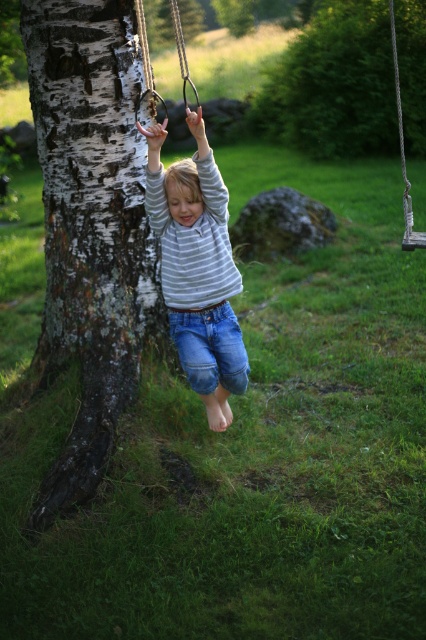
Where is `green leafy tree at upper center`? This screenshot has height=640, width=426. green leafy tree at upper center is located at coordinates (333, 84).

Who is positioned more to the left, green leafy tree at upper center or striped cotton shirt at center?

From the viewer's perspective, striped cotton shirt at center appears more on the left side.

Image resolution: width=426 pixels, height=640 pixels. What do you see at coordinates (333, 84) in the screenshot?
I see `green leafy tree at upper center` at bounding box center [333, 84].

Locate an element on the screen. The image size is (426, 640). green leafy tree at upper center is located at coordinates (333, 84).

Does white bark tree trunk at left have a smaller size compared to striped cotton shirt at center?

No, white bark tree trunk at left is not smaller than striped cotton shirt at center.

Does white bark tree trunk at left have a greater height compared to striped cotton shirt at center?

Yes.

Who is more distant from viewer, (58, 90) or (219, 369)?

The point (58, 90) is more distant.

This screenshot has width=426, height=640. In order to click on white bark tree trunk at left in this screenshot , I will do `click(89, 224)`.

Which of these two, white bark tree trunk at left or green leafy tree at upper center, stands taller?

green leafy tree at upper center is taller.

Is white bark tree trunk at left positioned behind green leafy tree at upper center?

No, it is in front of green leafy tree at upper center.

Which is behind, point (126, 289) or point (316, 150)?

The point (316, 150) is behind.

Where is `white bark tree trunk at left`? This screenshot has width=426, height=640. white bark tree trunk at left is located at coordinates (89, 224).